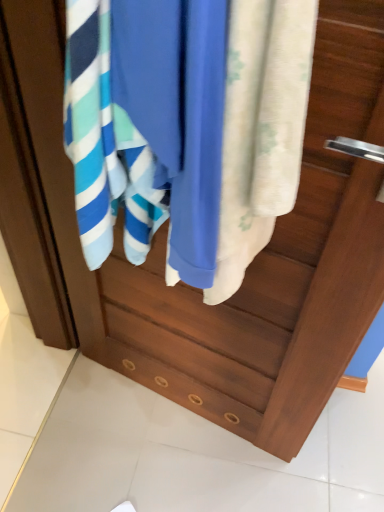
The width and height of the screenshot is (384, 512). Describe the element at coordinates (261, 129) in the screenshot. I see `silky white towel at center` at that location.

Locate an element on the screen. silky white towel at center is located at coordinates (261, 129).

Image resolution: width=384 pixels, height=512 pixels. Identify the location of blue cotton towel at center. (187, 127).

Image resolution: width=384 pixels, height=512 pixels. Describe the element at coordinates (187, 127) in the screenshot. I see `blue cotton towel at center` at that location.

Image resolution: width=384 pixels, height=512 pixels. Identify the location of silky white towel at center. (261, 129).

Visually, is blue cotton towel at center positioned to the left or to the right of silky white towel at center?

Clearly, blue cotton towel at center is on the left of silky white towel at center in the image.

Considering their positions, is blue cotton towel at center located in front of or behind silky white towel at center?

Visually, blue cotton towel at center is located behind silky white towel at center.

Does point (113, 187) come closer to viewer compared to point (231, 117)?

That is False.

From the image's perspective, which object appears higher, blue cotton towel at center or silky white towel at center?

From the image's view, blue cotton towel at center is above.

From a real-world perspective, is blue cotton towel at center on silky white towel at center?

Indeed, from a real-world perspective, blue cotton towel at center stands above silky white towel at center.

In terms of width, does blue cotton towel at center look wider or thinner when compared to silky white towel at center?

blue cotton towel at center is wider than silky white towel at center.

Considering the relative sizes of blue cotton towel at center and silky white towel at center in the image provided, is blue cotton towel at center shorter than silky white towel at center?

Indeed, blue cotton towel at center has a lesser height compared to silky white towel at center.

Looking at this image, based on their sizes in the image, would you say blue cotton towel at center is bigger or smaller than silky white towel at center?

Considering their sizes, blue cotton towel at center takes up more space than silky white towel at center.

Is silky white towel at center a part of blue cotton towel at center?

Result: Yes.

Is blue cotton towel at center far away from silky white towel at center?

That's not correct — blue cotton towel at center is a little close to silky white towel at center.

Is blue cotton towel at center turned away from silky white towel at center?

No, blue cotton towel at center is not facing away from silky white towel at center.

How much distance is there between blue cotton towel at center and silky white towel at center?

blue cotton towel at center and silky white towel at center are 2.64 inches apart from each other.

Identify the location of bath towel above the silky white towel at center (from a real-world perspective). The width and height of the screenshot is (384, 512). (187, 127).

Which object is positioned more to the left, silky white towel at center or blue cotton towel at center?

Positioned to the left is blue cotton towel at center.

Between silky white towel at center and blue cotton towel at center, which one is positioned behind?

blue cotton towel at center is behind.

Does point (311, 60) appear closer or farther from the camera than point (256, 214)?

Point (311, 60) is closer to the camera than point (256, 214).

From the image's perspective, is silky white towel at center under blue cotton towel at center?

Yes, from the image's perspective, silky white towel at center is beneath blue cotton towel at center.

From a real-world perspective, which object stands above the other?

From a 3D spatial view, blue cotton towel at center is above.

Between silky white towel at center and blue cotton towel at center, which one has larger width?

blue cotton towel at center is wider.

Does silky white towel at center have a lesser height compared to blue cotton towel at center?

Incorrect, the height of silky white towel at center does not fall short of that of blue cotton towel at center.

Who is smaller, silky white towel at center or blue cotton towel at center?

With smaller size is silky white towel at center.

Looking at this image, is silky white towel at center not inside blue cotton towel at center?

Actually, silky white towel at center is at least partially inside blue cotton towel at center.

Is silky white towel at center not near blue cotton towel at center?

silky white towel at center is near blue cotton towel at center, not far away.

Is silky white towel at center positioned with its back to blue cotton towel at center?

silky white towel at center is not turned away from blue cotton towel at center.

Based on the photo, how many degrees apart are the facing directions of silky white towel at center and blue cotton towel at center?

The angular difference between silky white towel at center and blue cotton towel at center is 0.000256 degrees.

Locate an element on the screen. towel in front of the blue cotton towel at center is located at coordinates (261, 129).

At what (x,y) coordinates should I click in order to perform the action: click on towel that is in front of the blue cotton towel at center. Please return your answer as a coordinate pair (x, y). Looking at the image, I should click on (261, 129).

In order to click on bath towel lying on the left of silky white towel at center in this screenshot , I will do `click(187, 127)`.